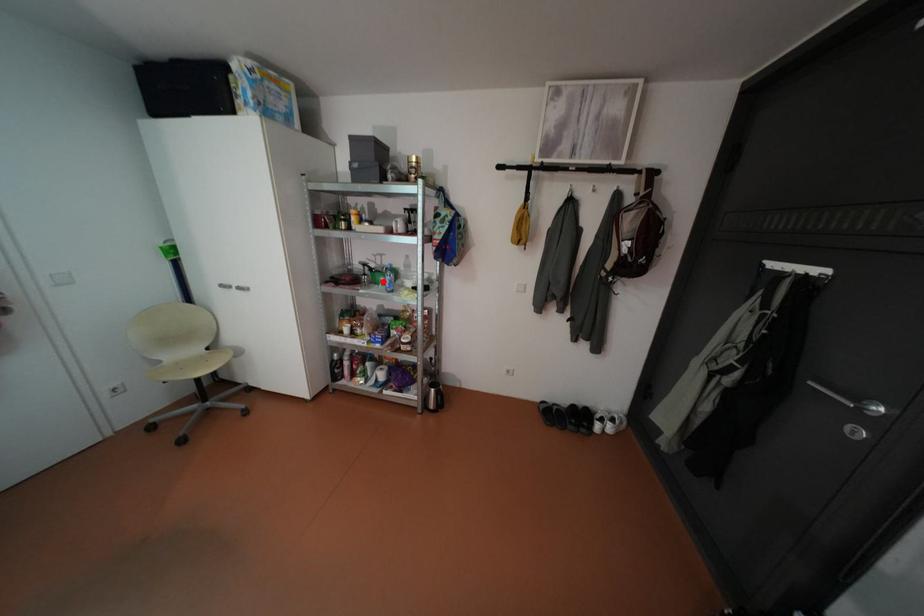
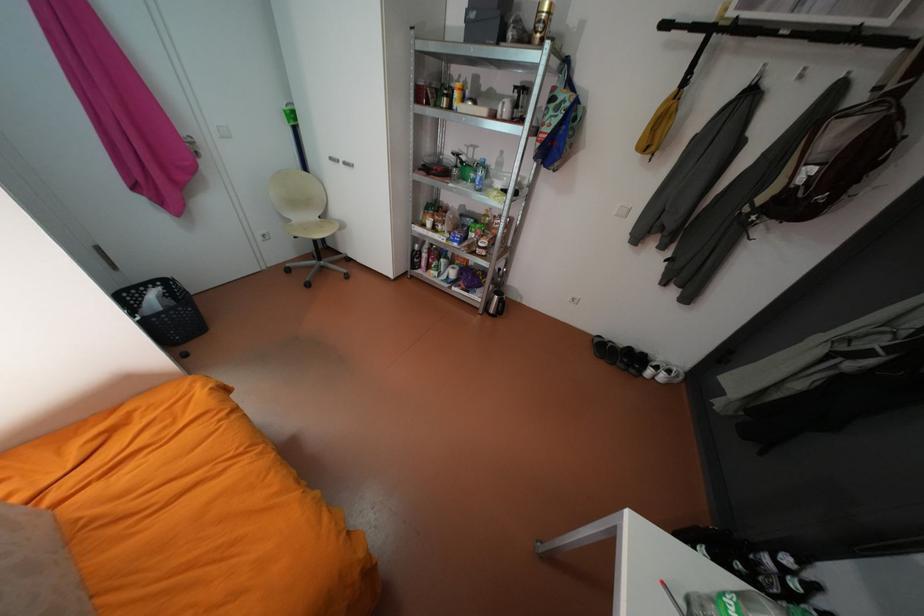
Where in the second image is the point corresponding to the highlighted location from the first image?

(471, 177)